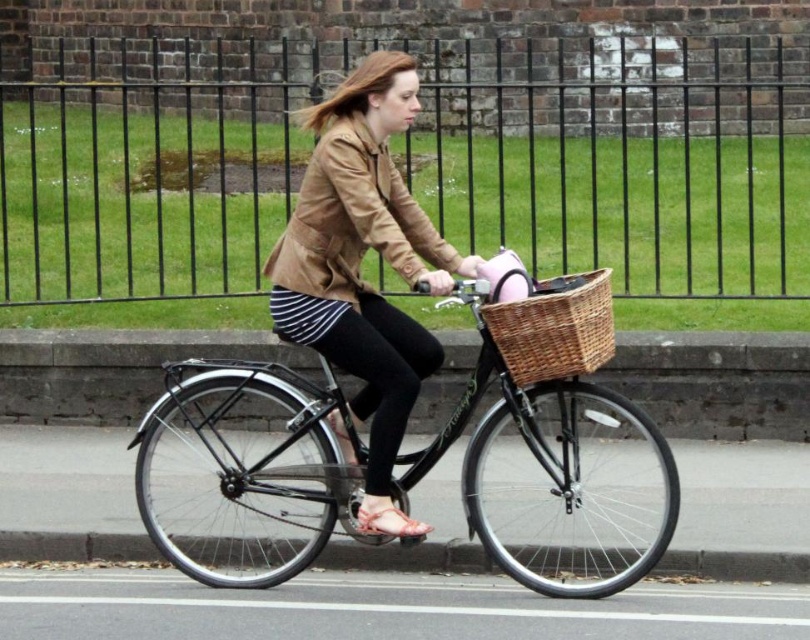
You are a delivery drone that needs to fly through the space between the black iron fence at upper center and the black matte bicycle at center. Can you pass through this space if your drone is 1 meter wide?

The black iron fence at upper center might be wider than the black matte bicycle at center, but without knowing the exact width of the space between them, it is uncertain if the drone can pass through safely. Please check the actual distance before attempting.

From the picture: You are planning to place a new decorative item on the black matte bicycle at center. Considering the size of the woven brown basket at center, will the new item fit on the bicycle if it is the same size as the basket?

The black matte bicycle at center is bigger than the woven brown basket at center, so an item the same size as the basket will fit on the bicycle.

You are a delivery person who needs to attach a small package to the black matte bicycle at center and the woven brown basket at center. Which object should you place the package on if you want it closer to the rider?

The woven brown basket at center is positioned on the right side of the black matte bicycle at center, so placing the package on the woven brown basket at center would make it closer to the rider.